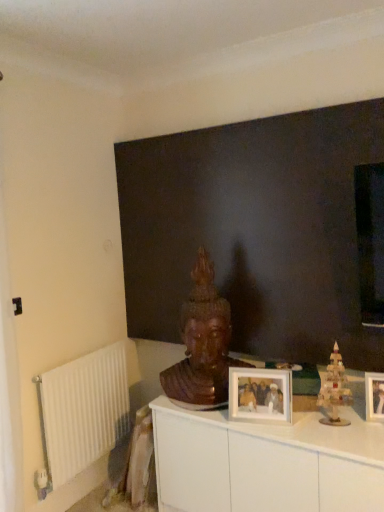
Where is `vacant space to the right of wooden christmas tree at right`? This screenshot has width=384, height=512. vacant space to the right of wooden christmas tree at right is located at coordinates (363, 421).